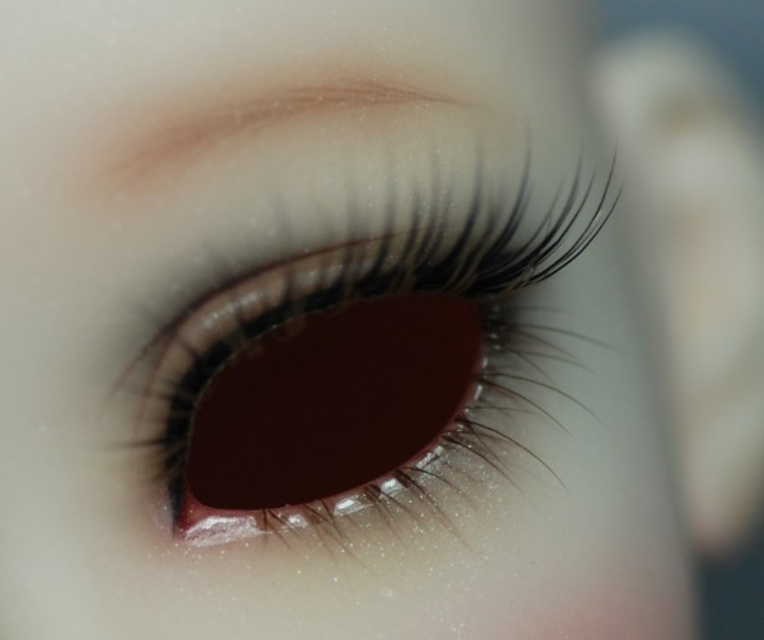
Question: Is shiny brown contact lens at center smaller than matte brown eyebrow at upper center?

Choices:
 (A) yes
 (B) no

Answer: (B)

Question: Among these objects, which one is nearest to the camera?

Choices:
 (A) shiny brown contact lens at center
 (B) matte brown eyebrow at upper center

Answer: (B)

Question: Among these objects, which one is farthest from the camera?

Choices:
 (A) shiny brown contact lens at center
 (B) matte brown eyebrow at upper center

Answer: (A)

Question: Does shiny brown contact lens at center lie behind matte brown eyebrow at upper center?

Choices:
 (A) yes
 (B) no

Answer: (A)

Question: Is shiny brown contact lens at center below matte brown eyebrow at upper center?

Choices:
 (A) no
 (B) yes

Answer: (B)